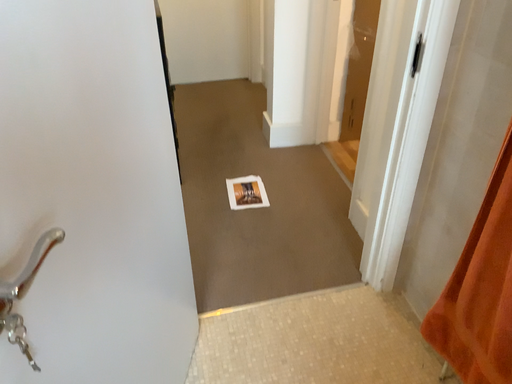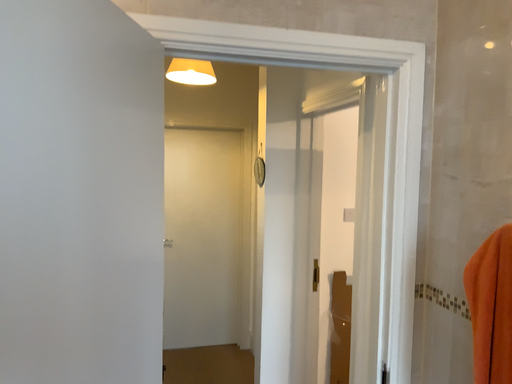
Question: How did the camera likely rotate when shooting the video?

Choices:
 (A) rotated upward
 (B) rotated downward

Answer: (A)